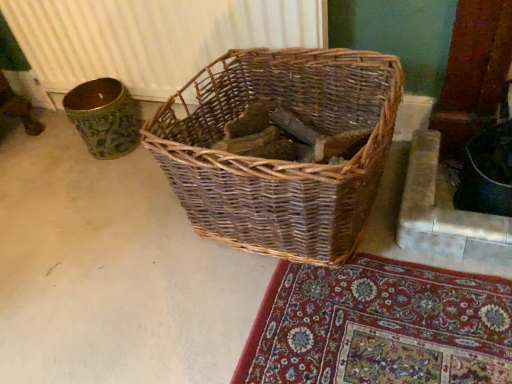
Question: From a real-world perspective, is white textured radiator at upper center physically located above or below woven brown basket at center?

Choices:
 (A) below
 (B) above

Answer: (B)

Question: Based on their sizes in the image, would you say white textured radiator at upper center is bigger or smaller than woven brown basket at center?

Choices:
 (A) big
 (B) small

Answer: (B)

Question: From the image's perspective, relative to woven brown basket at center, is white textured radiator at upper center above or below?

Choices:
 (A) below
 (B) above

Answer: (B)

Question: Does point (365, 163) appear closer or farther from the camera than point (151, 36)?

Choices:
 (A) farther
 (B) closer

Answer: (B)

Question: Relative to white textured radiator at upper center, is woven brown basket at center in front or behind?

Choices:
 (A) front
 (B) behind

Answer: (A)

Question: Looking at their shapes, would you say woven brown basket at center is wider or thinner than white textured radiator at upper center?

Choices:
 (A) wide
 (B) thin

Answer: (A)

Question: Considering the positions of woven brown basket at center and white textured radiator at upper center in the image, is woven brown basket at center taller or shorter than white textured radiator at upper center?

Choices:
 (A) short
 (B) tall

Answer: (A)